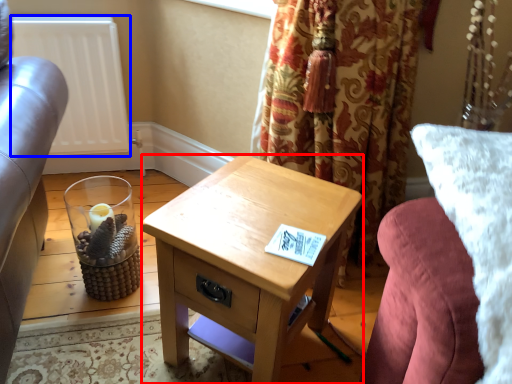
Question: Which of the following is the closest to the observer, nightstand (highlighted by a red box) or radiator (highlighted by a blue box)?

Choices:
 (A) nightstand
 (B) radiator

Answer: (A)